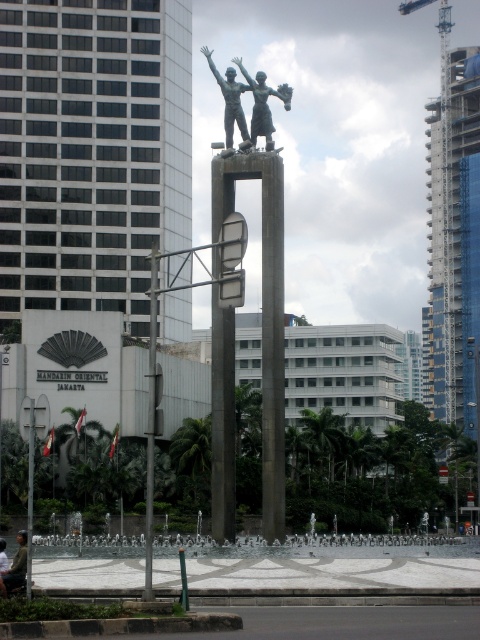
Who is lower down, metallic pole at center or polished bronze statue at center?

metallic pole at center is lower down.

Does point (154, 474) come behind point (288, 109)?

No, (154, 474) is in front of (288, 109).

Find the location of a particular element. metallic pole at center is located at coordinates (152, 420).

Between polished bronze statue at center and silver metallic statue at center, which one has more height?

silver metallic statue at center

Is point (267, 147) positioned after point (251, 88)?

No, it is not.

At what (x,y) coordinates should I click in order to perform the action: click on polished bronze statue at center. Please return your answer as a coordinate pair (x, y). Looking at the image, I should click on (264, 104).

Where is `polished bronze statue at center`? This screenshot has width=480, height=640. polished bronze statue at center is located at coordinates (264, 104).

Does glassy blue skyscraper at right come behind silver metallic statue at center?

Yes, it is.

Can you confirm if glassy blue skyscraper at right is positioned to the left of silver metallic statue at center?

Incorrect, glassy blue skyscraper at right is not on the left side of silver metallic statue at center.

This screenshot has width=480, height=640. Describe the element at coordinates (455, 237) in the screenshot. I see `glassy blue skyscraper at right` at that location.

Identify the location of glassy blue skyscraper at right. The image size is (480, 640). [x=455, y=237].